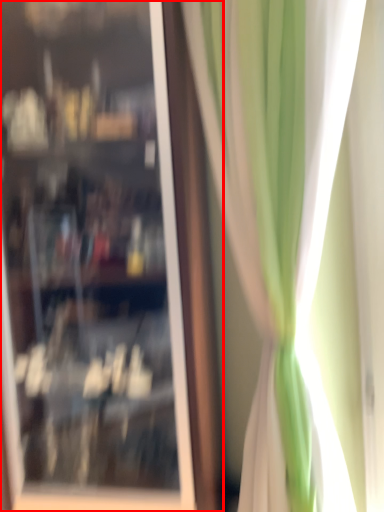
Question: From the image, what is the correct spatial relationship of shop window (annotated by the red box) in relation to curtain?

Choices:
 (A) right
 (B) left

Answer: (B)